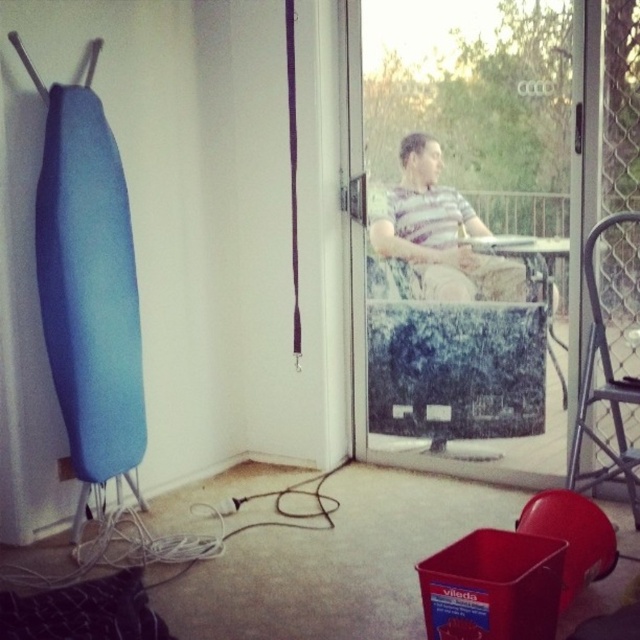
You are a delivery person approaching the transparent glass door at center and the striped fabric shirt at center. Which object is closer to the door frame?

The striped fabric shirt at center is closer to the door frame because the transparent glass door at center is positioned on the right side of it, placing the shirt nearer to the frame.

You are standing in the room and want to reach the point marked as point (440, 252). Can you walk directly to it without moving any objects?

The point (440, 252) is 3.61 meters away from the viewer, so yes, you can walk directly to it without needing to move any objects since there are no obstacles mentioned in the scene description between you and the point.

You are a delivery person holding a package that requires you to pass through the transparent glass door at center to reach the striped fabric shirt at center. The minimum required distance between the door and the recipient is 6 inches for safe delivery. Can you proceed with the delivery?

The transparent glass door at center and striped fabric shirt at center are 6.61 inches apart, which is more than the required 6 inches. Therefore, you can proceed with the delivery safely.